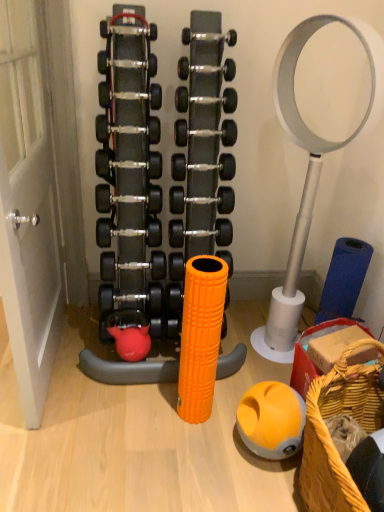
Find the location of a particular element. This screenshot has width=384, height=512. free space on the front side of orange rubber ball at lower center is located at coordinates (263, 489).